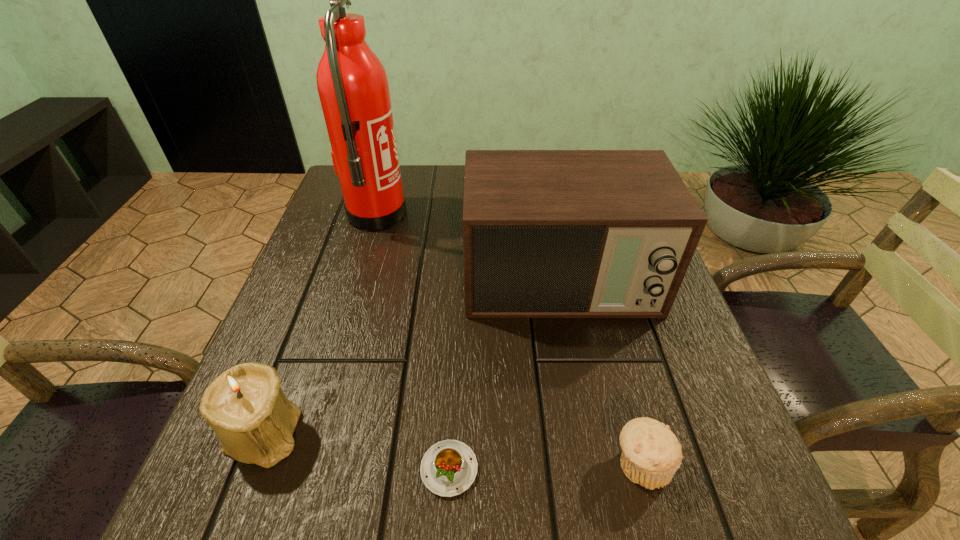
Locate an element on the screen. object that is positioned at the near right corner is located at coordinates (651, 454).

You are a GUI agent. You are given a task and a screenshot of the screen. Output one action in this format:
    pyautogui.click(x=<x>, y=<y>)
    Task: Click on the vacant position at the far edge of the desktop
    
    Given the screenshot: What is the action you would take?
    pyautogui.click(x=428, y=180)

Locate an element on the screen. The image size is (960, 540). free space at the near edge is located at coordinates (396, 492).

Image resolution: width=960 pixels, height=540 pixels. Find the location of `blank space at the left edge of the desktop`. blank space at the left edge of the desktop is located at coordinates (306, 410).

The width and height of the screenshot is (960, 540). In the image, there is a desktop. What are the coordinates of `free space at the right edge` in the screenshot? It's located at (620, 349).

The height and width of the screenshot is (540, 960). I want to click on free region at the near right corner of the desktop, so click(660, 537).

Locate an element on the screen. This screenshot has height=540, width=960. vacant space that is in between the fire extinguisher and the muffin is located at coordinates (509, 340).

Locate an element on the screen. Image resolution: width=960 pixels, height=540 pixels. empty space that is in between the third tallest object and the fourth shortest object is located at coordinates (412, 357).

What are the coordinates of `vacant space in between the third shortest object and the fire extinguisher` in the screenshot? It's located at (320, 324).

I want to click on vacant space that's between the third tallest object and the pudding, so [x=356, y=451].